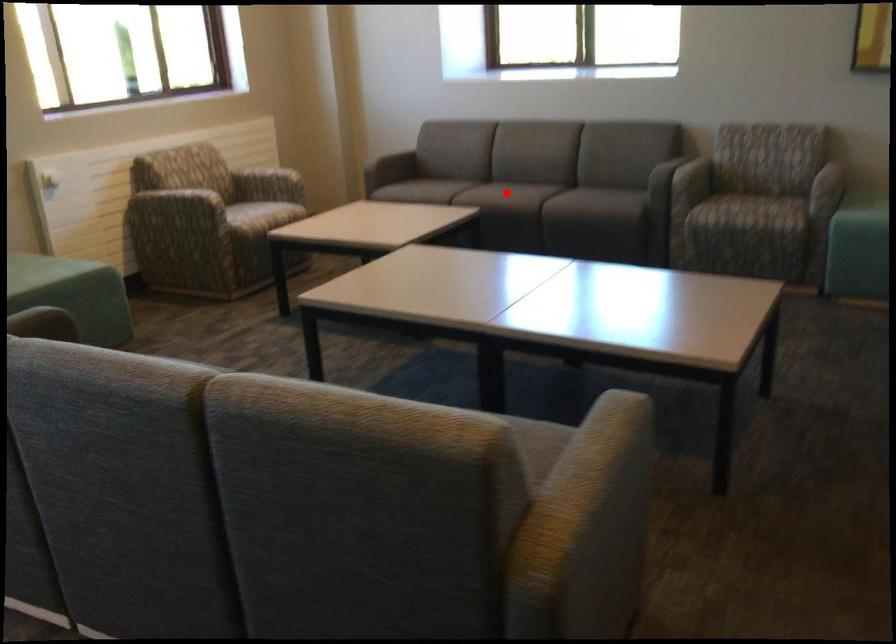
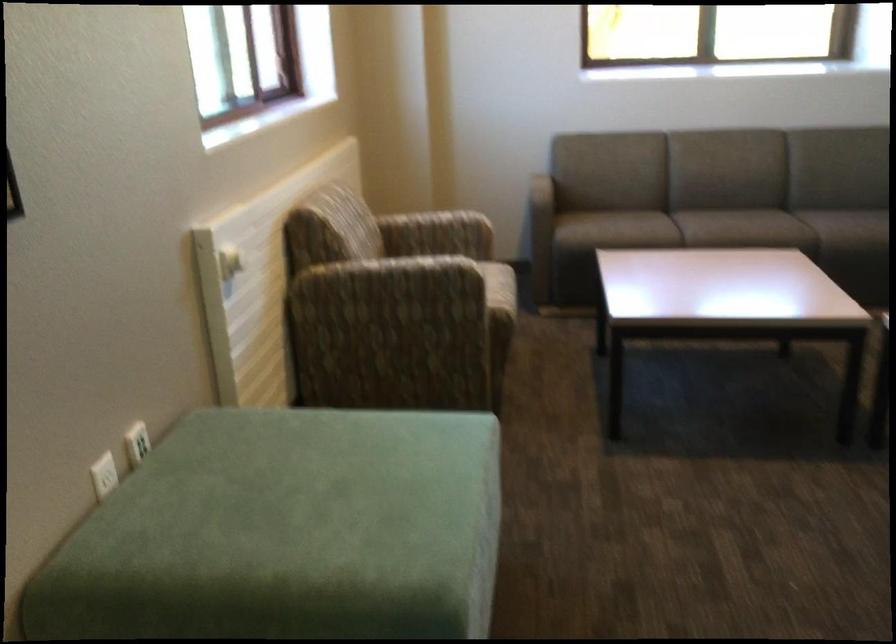
Locate, in the second image, the point that corresponds to the highlighted location in the first image.

(780, 229)